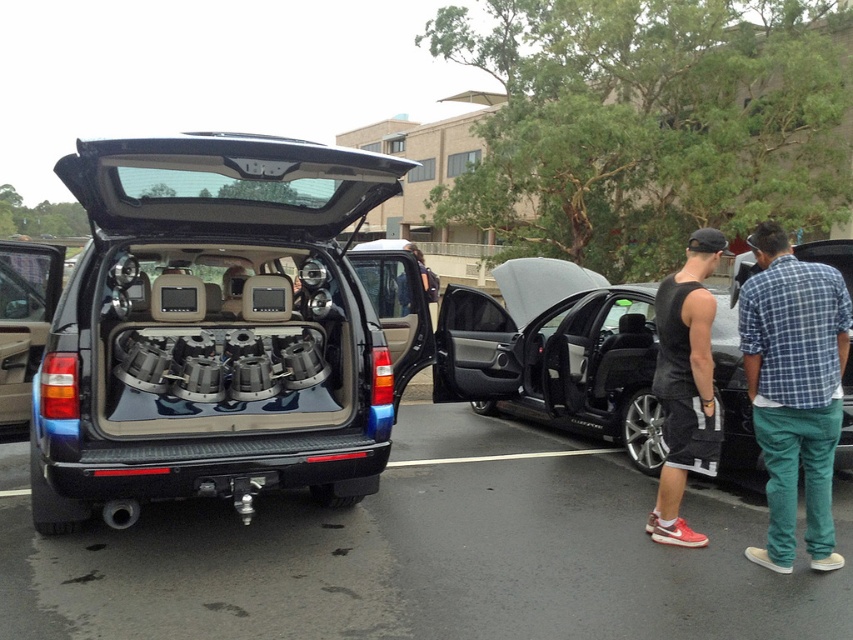
Who is positioned more to the left, blue plaid shirt at right or black sleeveless tank top at center?

black sleeveless tank top at center is more to the left.

Is blue plaid shirt at right thinner than black sleeveless tank top at center?

Incorrect, blue plaid shirt at right's width is not less than black sleeveless tank top at center's.

Describe the element at coordinates (793, 388) in the screenshot. Image resolution: width=853 pixels, height=640 pixels. I see `blue plaid shirt at right` at that location.

Find the location of a particular element. blue plaid shirt at right is located at coordinates (793, 388).

Does shiny metallic minivan at center have a lesser height compared to black sleeveless tank top at center?

Incorrect, shiny metallic minivan at center's height does not fall short of black sleeveless tank top at center's.

Image resolution: width=853 pixels, height=640 pixels. What do you see at coordinates (212, 330) in the screenshot? I see `shiny metallic minivan at center` at bounding box center [212, 330].

Locate an element on the screen. The width and height of the screenshot is (853, 640). shiny metallic minivan at center is located at coordinates (212, 330).

Which is in front, point (73, 572) or point (561, 332)?

Point (73, 572)

The height and width of the screenshot is (640, 853). What are the coordinates of `black plastic car at center` in the screenshot? It's located at (427, 556).

Find the location of a particular element. This screenshot has width=853, height=640. black plastic car at center is located at coordinates (427, 556).